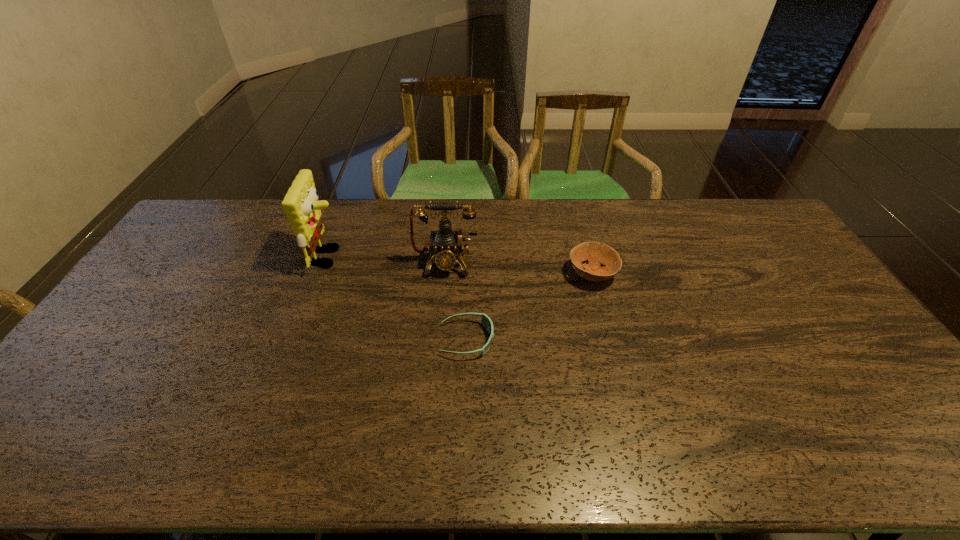
You are a GUI agent. You are given a task and a screenshot of the screen. Output one action in this format:
    pyautogui.click(x=<x>, y=<y>)
    Task: Click on the free space located on the front-facing side of the shortest object
    
    Given the screenshot: What is the action you would take?
    pyautogui.click(x=619, y=340)

I want to click on free space at the far edge, so click(x=564, y=202).

Image resolution: width=960 pixels, height=540 pixels. In the image, there is a desktop. What are the coordinates of `vacant space at the near edge` in the screenshot? It's located at (312, 433).

Locate an element on the screen. blank space at the left edge is located at coordinates (98, 351).

Where is `vacant region at the right edge of the desktop`? The width and height of the screenshot is (960, 540). vacant region at the right edge of the desktop is located at coordinates (843, 351).

The image size is (960, 540). What are the coordinates of `blank region between the third shortest object and the nearest object` in the screenshot? It's located at (456, 301).

Identify the location of unoccupied area between the third shortest object and the tallest object. (387, 260).

I want to click on vacant point located between the bowl and the third shortest object, so click(x=518, y=268).

At what (x,y) coordinates should I click in order to perform the action: click on vacant region between the shortest object and the telephone. Please return your answer as a coordinate pair (x, y). The height and width of the screenshot is (540, 960). Looking at the image, I should click on (456, 301).

The height and width of the screenshot is (540, 960). Identify the location of vacant space that is in between the goggles and the leftmost object. (398, 299).